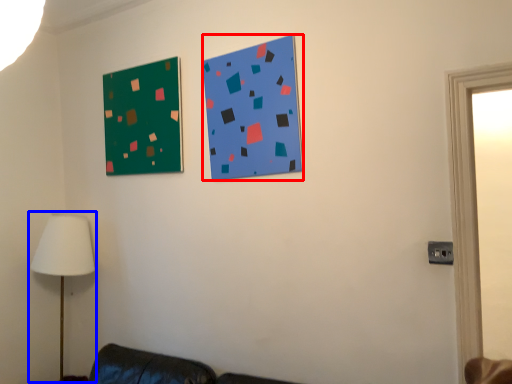
Question: Among these objects, which one is farthest to the camera, bulletin board (highlighted by a red box) or table lamp (highlighted by a blue box)?

Choices:
 (A) bulletin board
 (B) table lamp

Answer: (B)